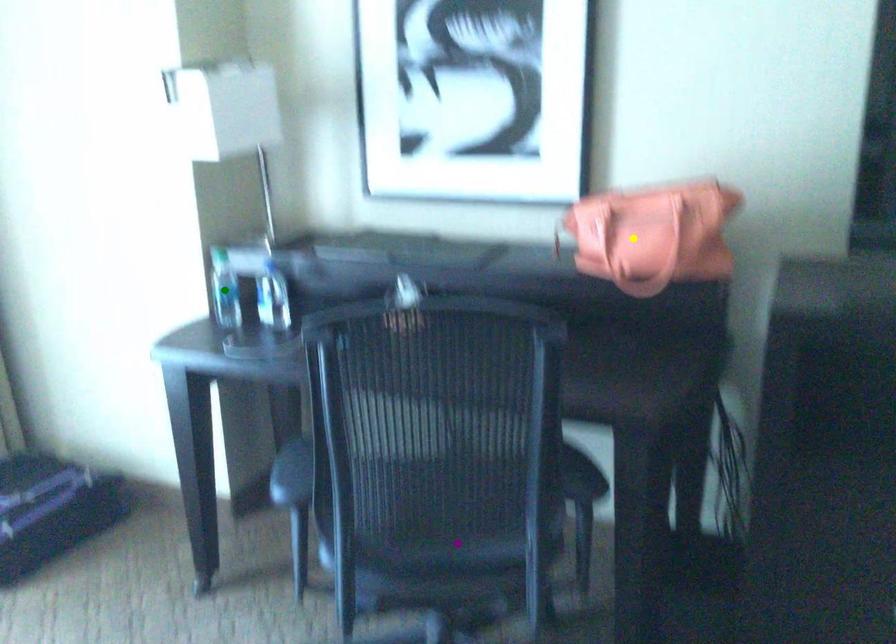
Order these from nearest to farthest:
1. green point
2. yellow point
3. purple point

purple point → yellow point → green point